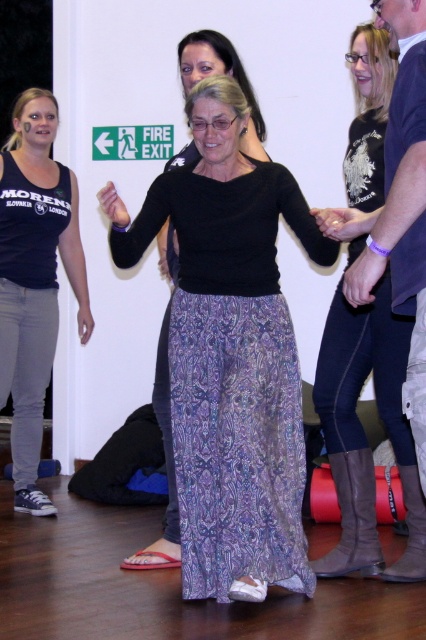
Question: Does patterned fabric skirt at center appear on the right side of purple printed skirt at center?

Choices:
 (A) yes
 (B) no

Answer: (A)

Question: Which object is farther from the camera taking this photo?

Choices:
 (A) patterned fabric skirt at center
 (B) purple printed skirt at center

Answer: (B)

Question: Is patterned fabric skirt at center bigger than purple printed skirt at center?

Choices:
 (A) yes
 (B) no

Answer: (A)

Question: Which object is closer to the camera taking this photo?

Choices:
 (A) matte black tank top at left
 (B) patterned fabric skirt at center

Answer: (B)

Question: Can you confirm if patterned fabric skirt at center is positioned below matte black tank top at left?

Choices:
 (A) yes
 (B) no

Answer: (A)

Question: Among these points, which one is nearest to the camera?

Choices:
 (A) (221, 56)
 (B) (17, 182)

Answer: (A)